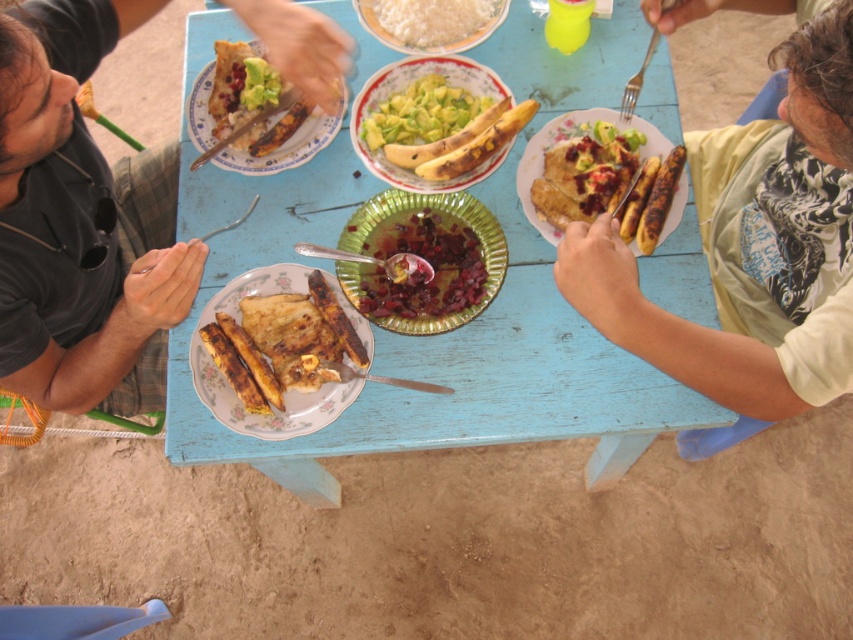
Can you confirm if green matte platter at center is positioned below white matte rice at center?

Yes.

Does green matte platter at center have a larger size compared to white matte rice at center?

Indeed, green matte platter at center has a larger size compared to white matte rice at center.

You are a GUI agent. You are given a task and a screenshot of the screen. Output one action in this format:
    pyautogui.click(x=<x>, y=<y>)
    Task: Click on the green matte platter at center
    
    Given the screenshot: What is the action you would take?
    pyautogui.click(x=403, y=88)

Can you confirm if grilled banana at center is taller than green matte platter at center?

Indeed, grilled banana at center has a greater height compared to green matte platter at center.

Can you confirm if grilled banana at center is smaller than green matte platter at center?

Correct, grilled banana at center occupies less space than green matte platter at center.

Find the location of `grilled banana at center`. grilled banana at center is located at coordinates (283, 394).

Is matte ceramic plate at upper center thinner than green matte platter at center?

No, matte ceramic plate at upper center is not thinner than green matte platter at center.

Describe the element at coordinates (254, 124) in the screenshot. I see `matte ceramic plate at upper center` at that location.

Which is in front, point (312, 134) or point (379, 77)?

Positioned in front is point (379, 77).

Locate an element on the screen. This screenshot has height=640, width=853. matte ceramic plate at upper center is located at coordinates (254, 124).